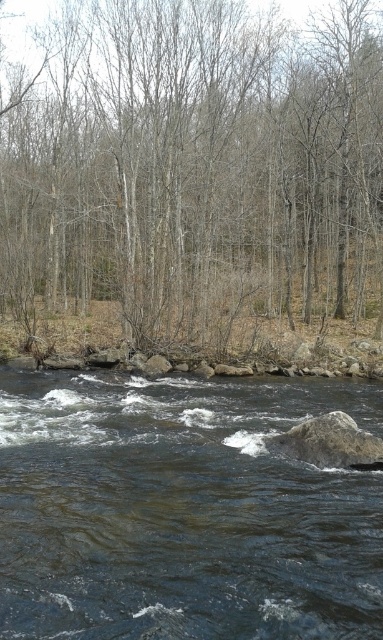
Does brown/dry wood trees at center have a larger size compared to gray rough rock at center?

Yes, brown/dry wood trees at center is bigger than gray rough rock at center.

In the scene shown: Can you confirm if brown/dry wood trees at center is positioned above gray rough rock at center?

Indeed, brown/dry wood trees at center is positioned over gray rough rock at center.

Find the location of a particular element. brown/dry wood trees at center is located at coordinates (196, 168).

Which is more to the left, dark brown water at center or gray rough rock at center?

Positioned to the left is dark brown water at center.

Locate an element on the screen. The height and width of the screenshot is (640, 383). dark brown water at center is located at coordinates (181, 512).

The height and width of the screenshot is (640, 383). Identify the location of dark brown water at center. (181, 512).

Is brown/dry wood trees at center thinner than dark brown water at center?

Incorrect, brown/dry wood trees at center's width is not less than dark brown water at center's.

Between brown/dry wood trees at center and dark brown water at center, which one has more height?

brown/dry wood trees at center is taller.

Is point (248, 38) closer to viewer compared to point (283, 556)?

That is False.

Find the location of a particular element. This screenshot has width=383, height=640. brown/dry wood trees at center is located at coordinates (196, 168).